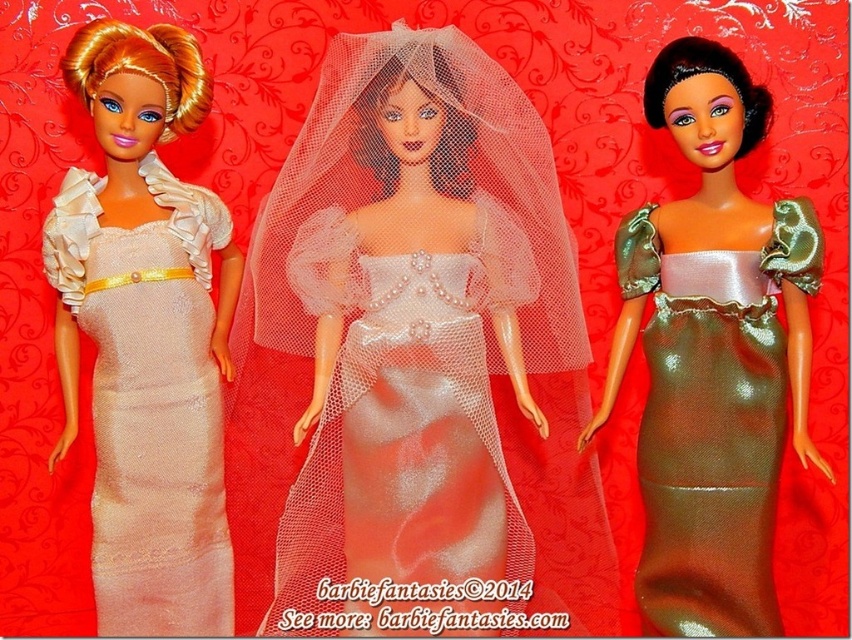
What is the color of the dress at point (x=430, y=336)?

The dress at point (x=430, y=336) is pearl white satin.